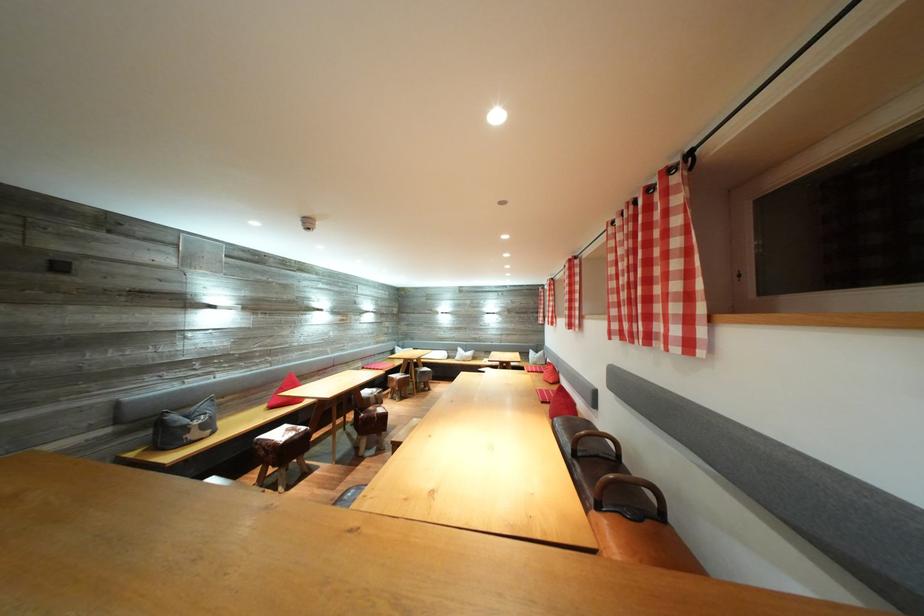
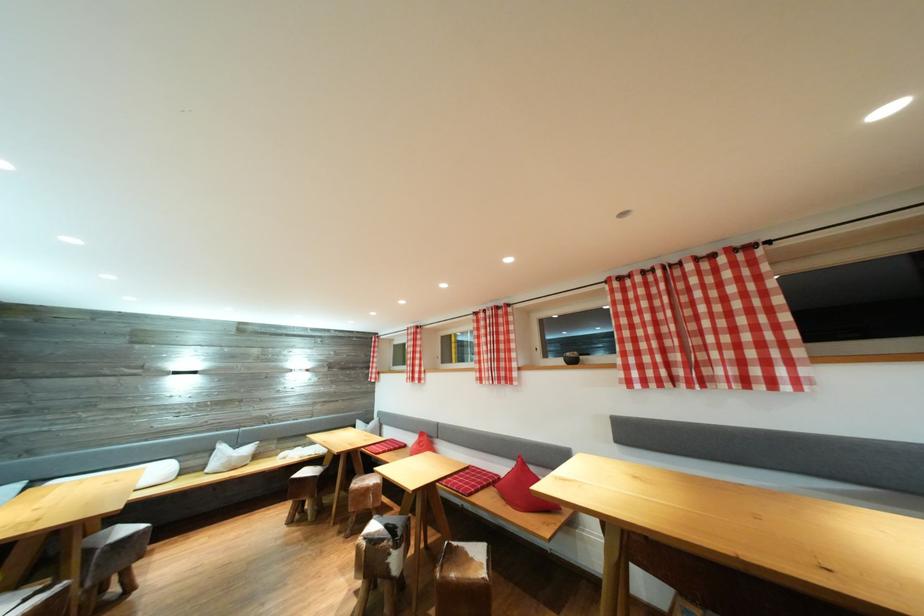
Locate, in the second image, the point that corresponds to [544,318] in the first image.

(375, 373)